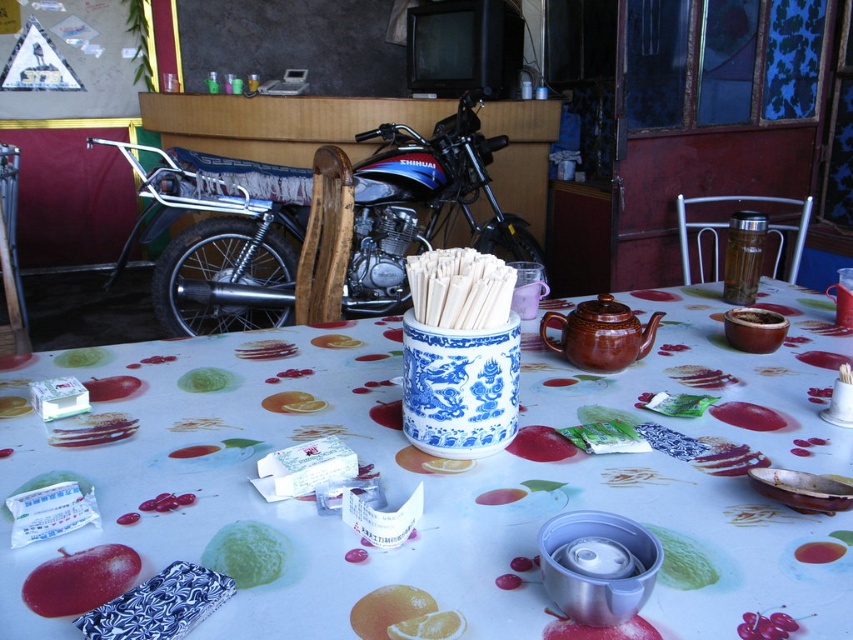
Question: Does shiny metallic motorcycle at center appear on the left side of red matte apple at lower left?

Choices:
 (A) no
 (B) yes

Answer: (B)

Question: Considering the real-world distances, which object is closest to the shiny metallic motorcycle at center?

Choices:
 (A) fruit-patterned fabric at center
 (B) red matte apple at lower left

Answer: (A)

Question: Is fruit-patterned fabric at center to the right of red matte apple at lower left from the viewer's perspective?

Choices:
 (A) no
 (B) yes

Answer: (B)

Question: Is fruit-patterned fabric at center positioned in front of shiny metallic motorcycle at center?

Choices:
 (A) yes
 (B) no

Answer: (A)

Question: Which object appears farthest from the camera in this image?

Choices:
 (A) fruit-patterned fabric at center
 (B) red matte apple at lower left

Answer: (B)

Question: Which point is farther to the camera?

Choices:
 (A) shiny metallic motorcycle at center
 (B) red matte apple at lower left
 (C) fruit-patterned fabric at center

Answer: (A)